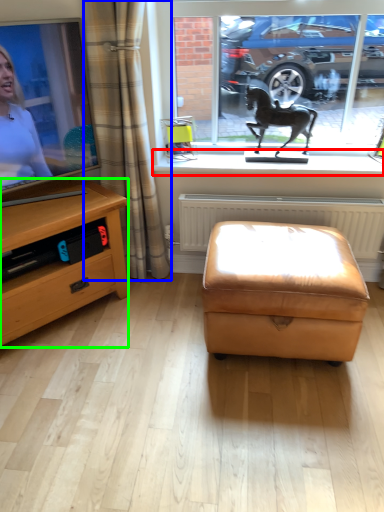
Question: Which is nearer to the window sill (highlighted by a red box)? curtain (highlighted by a blue box) or desk (highlighted by a green box).

Choices:
 (A) curtain
 (B) desk

Answer: (A)